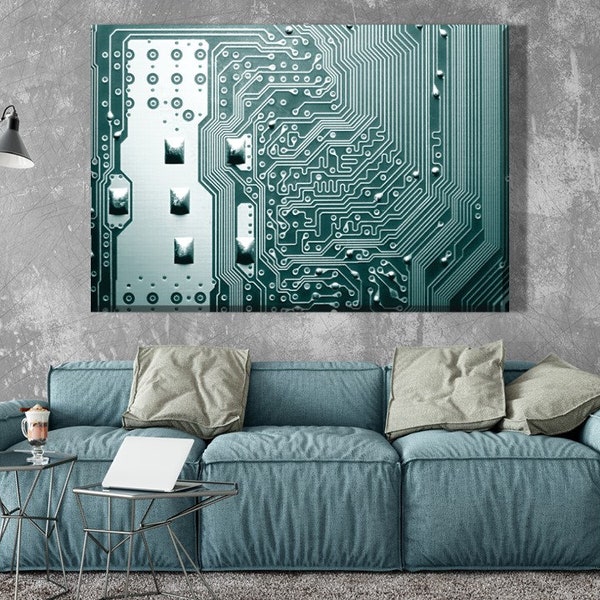
Locate an element on the screen. The height and width of the screenshot is (600, 600). couch is located at coordinates (305, 508).